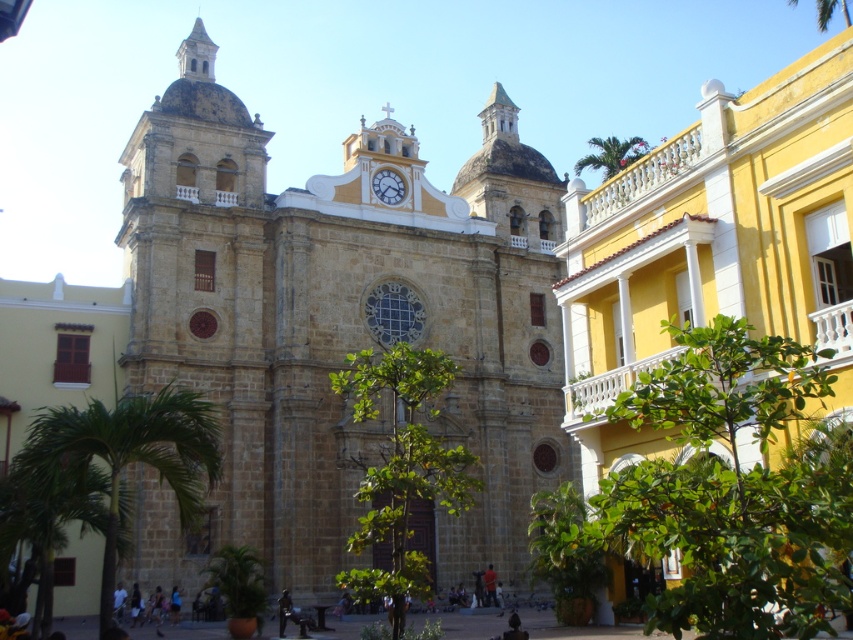
Question: Estimate the real-world distances between objects in this image. Which object is closer to the green leafy palm tree at upper right?

Choices:
 (A) green leafy palm tree at lower left
 (B) white marble clock at center
 (C) yellow stucco building at right
 (D) stone church at center

Answer: (D)

Question: Which object is farther from the camera taking this photo?

Choices:
 (A) green leafy palm tree at lower left
 (B) stone church at center

Answer: (B)

Question: Can you confirm if yellow stucco building at right is smaller than green leafy palm tree at upper right?

Choices:
 (A) yes
 (B) no

Answer: (A)

Question: Is stone church at center thinner than green leafy palm tree at upper right?

Choices:
 (A) no
 (B) yes

Answer: (A)

Question: Can you confirm if green leafy palm tree at left is thinner than white marble clock at center?

Choices:
 (A) yes
 (B) no

Answer: (B)

Question: Which point appears closest to the camera in this image?

Choices:
 (A) (659, 260)
 (B) (228, 570)
 (C) (172, 420)
 (D) (642, 154)

Answer: (A)